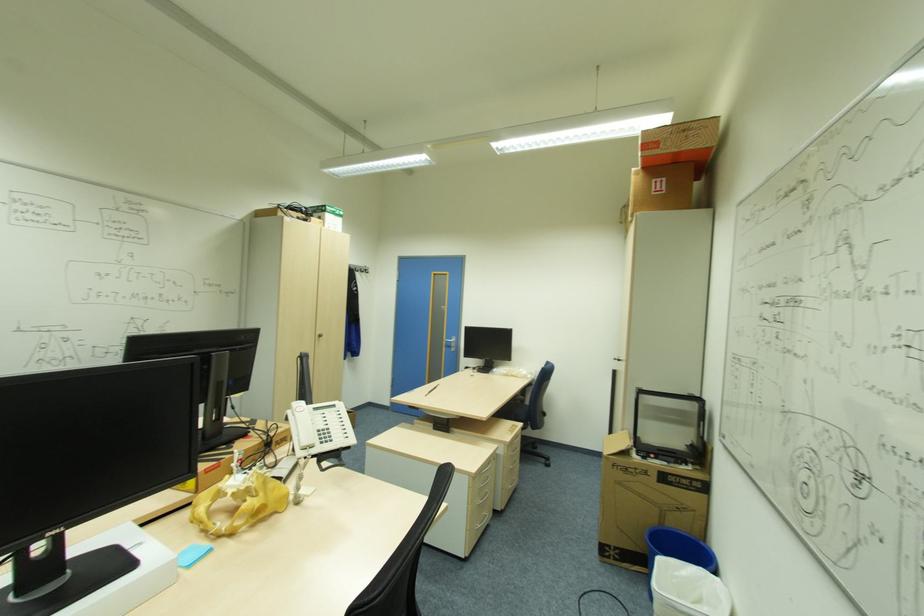
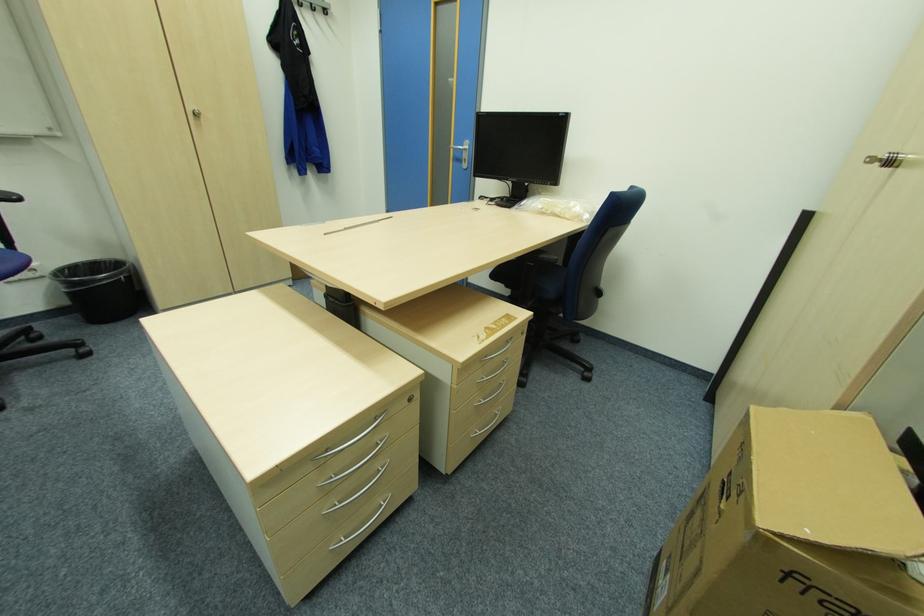
Locate, in the second image, the point that corresponds to point (617, 359) in the first image.

(873, 159)